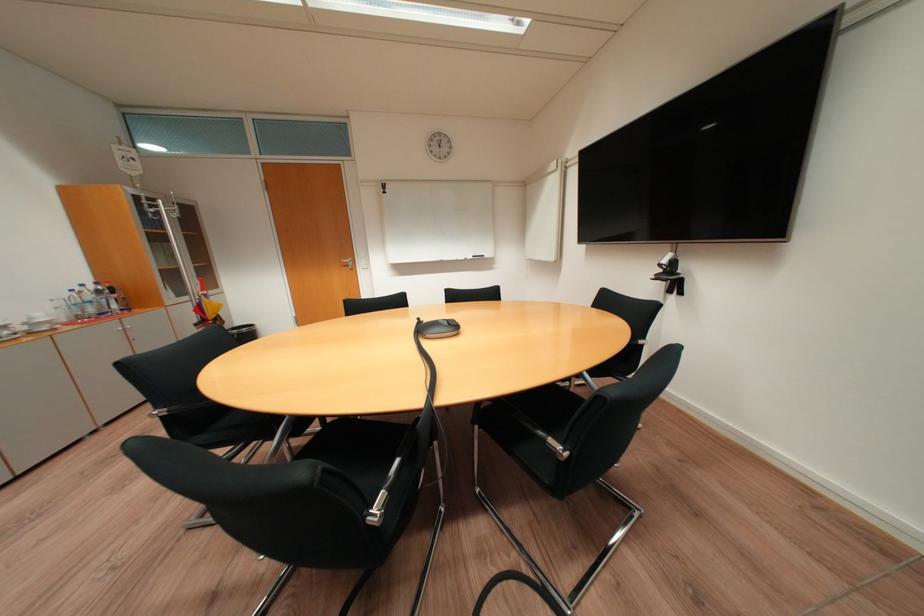
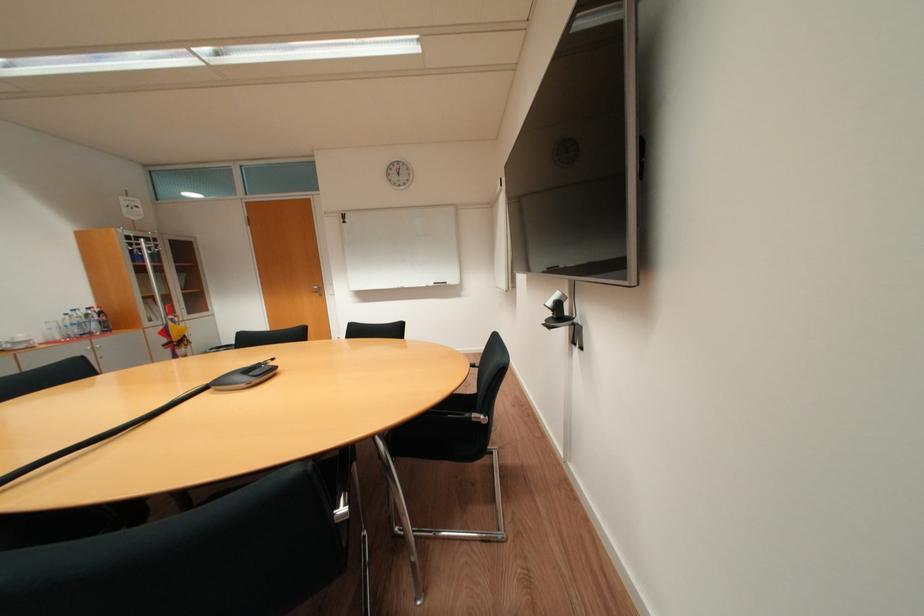
In the second image, find the point that corresponds to point (673, 262) in the first image.

(558, 304)